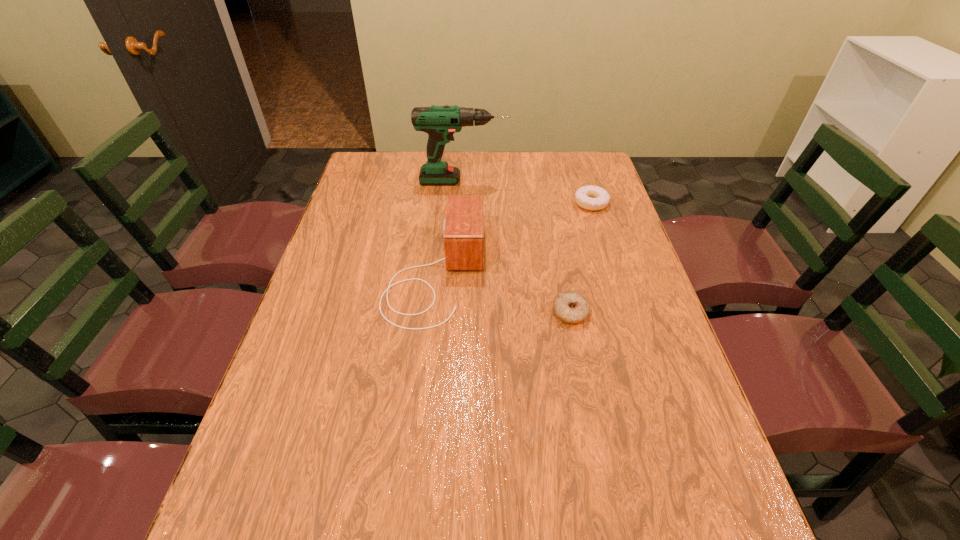
Identify the location of vacant space that satisfies the following two spatial constraints: 1. on the front-facing side of the second object from right to left; 2. on the right side of the third shortest object. The image size is (960, 540). (431, 313).

I want to click on vacant region that satisfies the following two spatial constraints: 1. on the handle side of the right doughnut; 2. on the right side of the drill, so click(462, 203).

This screenshot has height=540, width=960. Identify the location of vacant point that satisfies the following two spatial constraints: 1. on the handle side of the farthest object; 2. on the left side of the left doughnut. (457, 313).

Where is `vacant space that satisfies the following two spatial constraints: 1. on the handle side of the farthest object; 2. on the right side of the rightmost object`? vacant space that satisfies the following two spatial constraints: 1. on the handle side of the farthest object; 2. on the right side of the rightmost object is located at coordinates (462, 203).

Where is `free space in the image that satisfies the following two spatial constraints: 1. on the back side of the nearer doughnut; 2. on the handle side of the tallest object`? free space in the image that satisfies the following two spatial constraints: 1. on the back side of the nearer doughnut; 2. on the handle side of the tallest object is located at coordinates (x=544, y=181).

Locate an element on the screen. Image resolution: width=960 pixels, height=540 pixels. vacant space that satisfies the following two spatial constraints: 1. on the front-facing side of the radio receiver; 2. on the left side of the second object from right to left is located at coordinates (431, 313).

This screenshot has height=540, width=960. I want to click on free space in the image that satisfies the following two spatial constraints: 1. on the handle side of the tallest object; 2. on the back side of the second object from right to left, so click(x=457, y=313).

The height and width of the screenshot is (540, 960). What are the coordinates of `free space that satisfies the following two spatial constraints: 1. on the handle side of the drill; 2. on the left side of the farther doughnut` in the screenshot? It's located at (462, 203).

Image resolution: width=960 pixels, height=540 pixels. I want to click on vacant area in the image that satisfies the following two spatial constraints: 1. on the handle side of the second object from right to left; 2. on the right side of the drill, so click(x=457, y=313).